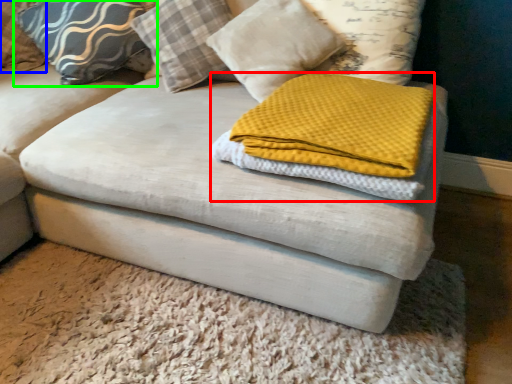
Question: Considering the real-world distances, which object is farthest from cloth (highlighted by a red box)? pillow (highlighted by a blue box) or pillow (highlighted by a green box)?

Choices:
 (A) pillow
 (B) pillow

Answer: (A)